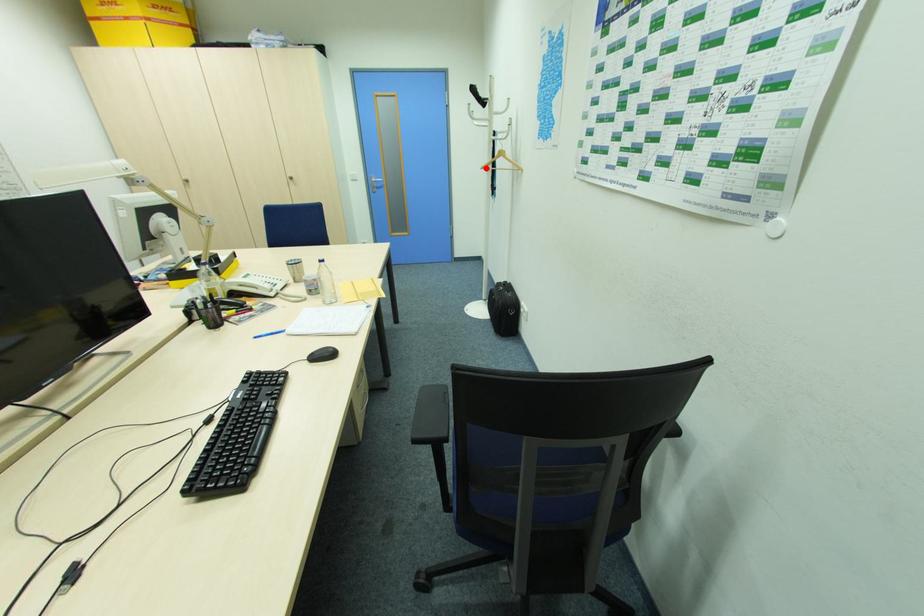
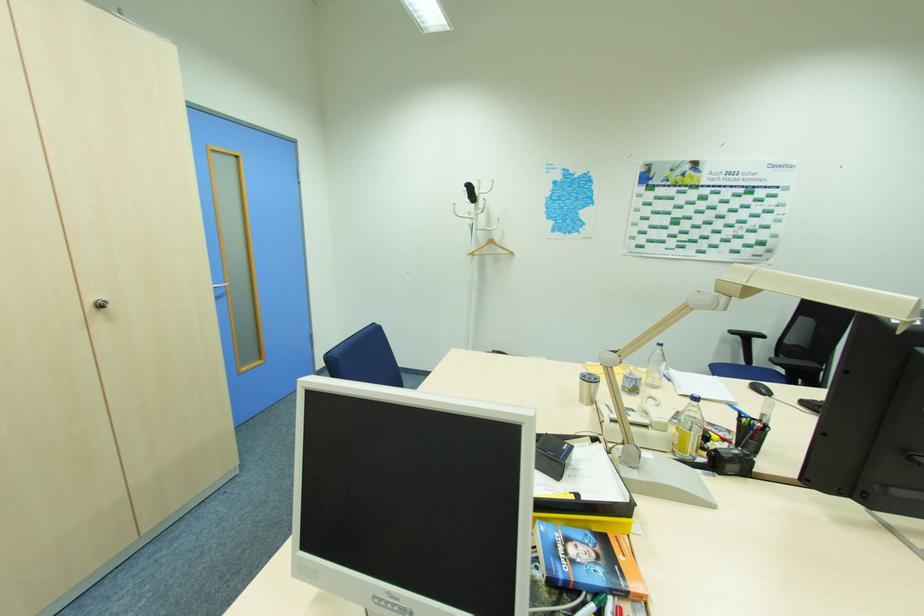
Where in the second image is the point corresponding to the highlighted location from the first image?

(472, 254)